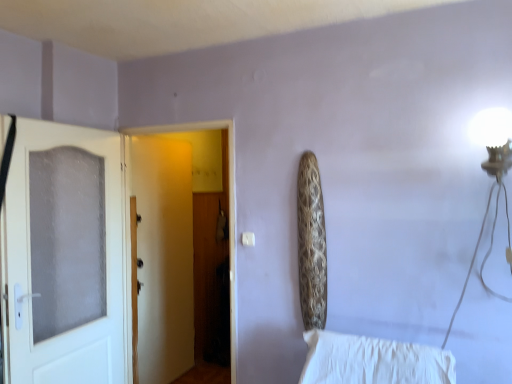
The width and height of the screenshot is (512, 384). Describe the element at coordinates (102, 267) in the screenshot. I see `white frosted glass door at left` at that location.

Where is `white frosted glass door at left`? This screenshot has height=384, width=512. white frosted glass door at left is located at coordinates (102, 267).

Where is `white frosted glass door at left`? white frosted glass door at left is located at coordinates (102, 267).